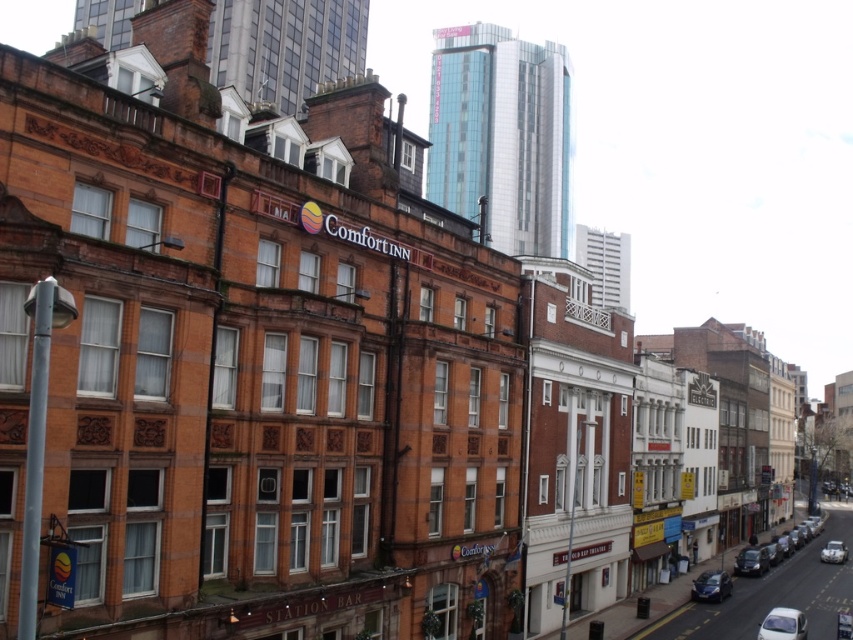
You are a delivery person trying to park your 1.8 meters tall delivery cart between the white glossy car at lower right and the shiny black car at lower right. Can your cart fit vertically between them?

The white glossy car at lower right is taller than the shiny black car at lower right. The vertical space between them would depend on their heights and the ground clearance. Since the white car is taller, the space above the shiny black car might be sufficient, but without exact measurements, it is uncertain. However, the question specifies the cart is 1.8 meters tall. If the vertical gap between the two cars is at least 1.8 meters, then yes. But based on the given info that the white car is taller, we can

You are a delivery driver who needs to park your van between the shiny black car at lower right and the silver metallic car at lower right. Based on the space between them, will your van, which is 2 meters wide, fit?

The shiny black car at lower right is thinner than the silver metallic car at lower right. However, the exact width between them isn not provided in the description. Therefore, it is impossible to determine if the van will fit without additional information.